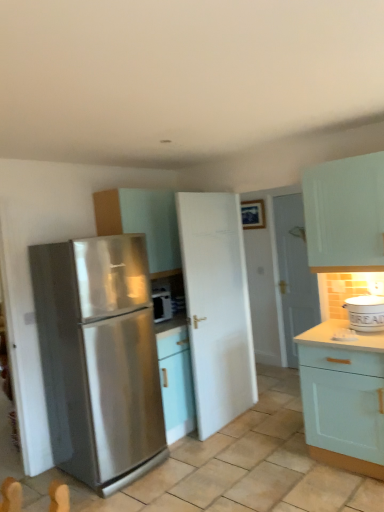
At what (x,y) coordinates should I click in order to perform the action: click on matte white cabinet at center, which is the first cabinetry from top to bottom. Please return your answer as a coordinate pair (x, y). Looking at the image, I should click on (142, 222).

Image resolution: width=384 pixels, height=512 pixels. I want to click on light teal wood cabinet at lower right, which is the second cabinetry in left-to-right order, so click(343, 398).

Consider the image. How much space does light teal wood cabinet at lower right, positioned as the 1th cabinetry in right-to-left order, occupy vertically?

The height of light teal wood cabinet at lower right, positioned as the 1th cabinetry in right-to-left order, is 35.00 inches.

Find the location of a particular element. This screenshot has height=512, width=384. white ceramic bucket at right, which is the 1th appliance from right to left is located at coordinates (365, 313).

Where is `stainless steel microwave at center, the first appliance from the back`? This screenshot has height=512, width=384. stainless steel microwave at center, the first appliance from the back is located at coordinates (161, 305).

Where is `stainless steel refrigerator at left`? The image size is (384, 512). stainless steel refrigerator at left is located at coordinates (99, 358).

Looking at this image, does stainless steel refrigerator at left appear on the left side of matte white cabinet at center, acting as the second cabinetry starting from the right?

Yes.

From the image's perspective, is stainless steel refrigerator at left over matte white cabinet at center, acting as the second cabinetry starting from the right?

No, from the image's perspective, stainless steel refrigerator at left is not over matte white cabinet at center, acting as the second cabinetry starting from the right.

Considering the positions of points (107, 433) and (121, 200), is point (107, 433) closer to camera compared to point (121, 200)?

Yes, point (107, 433) is closer to viewer.

From the picture: From a real-world perspective, which is physically above, stainless steel refrigerator at left or white matte door at center, which is counted as the 1th door, starting from the left?

From a 3D spatial view, white matte door at center, which is counted as the 1th door, starting from the left, is above.

Who is shorter, stainless steel refrigerator at left or white matte door at center, which is counted as the 1th door, starting from the left?

Standing shorter between the two is stainless steel refrigerator at left.

Is stainless steel refrigerator at left with white matte door at center, which ranks as the first door in front-to-back order?

No, stainless steel refrigerator at left is not with white matte door at center, which ranks as the first door in front-to-back order.

Is point (134, 406) closer or farther from the camera than point (235, 345)?

Point (134, 406) appears to be closer to the viewer than point (235, 345).

Considering the relative positions of white glossy door at center, positioned as the 2th door in left-to-right order, and white ceramic bucket at right, which is the 1th appliance from right to left, in the image provided, is white glossy door at center, positioned as the 2th door in left-to-right order, to the left of white ceramic bucket at right, which is the 1th appliance from right to left, from the viewer's perspective?

Indeed, white glossy door at center, positioned as the 2th door in left-to-right order, is positioned on the left side of white ceramic bucket at right, which is the 1th appliance from right to left.

Where is `appliance below the white glossy door at center, which is the second door from front to back (from a real-world perspective)`? The height and width of the screenshot is (512, 384). appliance below the white glossy door at center, which is the second door from front to back (from a real-world perspective) is located at coordinates (365, 313).

Can you confirm if white glossy door at center, which is the second door from front to back, is smaller than white ceramic bucket at right, the second appliance in the back-to-front sequence?

Incorrect, white glossy door at center, which is the second door from front to back, is not smaller in size than white ceramic bucket at right, the second appliance in the back-to-front sequence.

Considering the positions of point (225, 370) and point (380, 314), is point (225, 370) closer or farther from the camera than point (380, 314)?

Clearly, point (225, 370) is more distant from the camera than point (380, 314).

Is white matte door at center, which is counted as the 1th door, starting from the left, in front of or behind white ceramic bucket at right, the second appliance in the back-to-front sequence, in the image?

In the image, white matte door at center, which is counted as the 1th door, starting from the left, appears behind white ceramic bucket at right, the second appliance in the back-to-front sequence.

Which of these two, white matte door at center, arranged as the second door when viewed from the right, or white ceramic bucket at right, the second appliance in the back-to-front sequence, is wider?

white ceramic bucket at right, the second appliance in the back-to-front sequence.

From a real-world perspective, is white ceramic bucket at right, which is counted as the 2th appliance, starting from the left, over light teal wood cabinet at lower right, arranged as the 2th cabinetry when viewed from the back?

Yes, from a real-world perspective, white ceramic bucket at right, which is counted as the 2th appliance, starting from the left, is above light teal wood cabinet at lower right, arranged as the 2th cabinetry when viewed from the back.

Considering the relative positions of white ceramic bucket at right, the second appliance in the back-to-front sequence, and light teal wood cabinet at lower right, arranged as the 2th cabinetry when viewed from the back, in the image provided, is white ceramic bucket at right, the second appliance in the back-to-front sequence, in front of light teal wood cabinet at lower right, arranged as the 2th cabinetry when viewed from the back,?

No, white ceramic bucket at right, the second appliance in the back-to-front sequence, is behind light teal wood cabinet at lower right, arranged as the 2th cabinetry when viewed from the back.

Is white ceramic bucket at right, which is the first appliance from front to back, smaller than light teal wood cabinet at lower right, the second cabinetry from the top?

Yes.

How many degrees apart are the facing directions of white glossy door at center, the 1th door positioned from the back, and white matte door at center, acting as the 2th door starting from the back?

91 degrees separate the facing orientations of white glossy door at center, the 1th door positioned from the back, and white matte door at center, acting as the 2th door starting from the back.

Are white glossy door at center, positioned as the 2th door in left-to-right order, and white matte door at center, which is counted as the 1th door, starting from the left, far apart?

Indeed, white glossy door at center, positioned as the 2th door in left-to-right order, is not near white matte door at center, which is counted as the 1th door, starting from the left.

Could you tell me if white glossy door at center, positioned as the 2th door in left-to-right order, is turned towards white matte door at center, acting as the 2th door starting from the back?

Yes, white glossy door at center, positioned as the 2th door in left-to-right order, is aimed at white matte door at center, acting as the 2th door starting from the back.

Is the depth of white ceramic bucket at right, which is the 1th appliance from right to left, less than that of stainless steel microwave at center, the first appliance from the back?

Yes, it is.

Is stainless steel microwave at center, arranged as the 2th appliance when viewed from the front, inside white ceramic bucket at right, the second appliance in the back-to-front sequence?

Definitely not — stainless steel microwave at center, arranged as the 2th appliance when viewed from the front, is not inside white ceramic bucket at right, the second appliance in the back-to-front sequence.

Considering the relative positions of white ceramic bucket at right, which is the first appliance from front to back, and stainless steel microwave at center, arranged as the 2th appliance when viewed from the front, in the image provided, is white ceramic bucket at right, which is the first appliance from front to back, to the left of stainless steel microwave at center, arranged as the 2th appliance when viewed from the front, from the viewer's perspective?

No, white ceramic bucket at right, which is the first appliance from front to back, is not to the left of stainless steel microwave at center, arranged as the 2th appliance when viewed from the front.

Does white ceramic bucket at right, which is the first appliance from front to back, have a greater height compared to stainless steel microwave at center, the first appliance from the back?

No.

Image resolution: width=384 pixels, height=512 pixels. Identify the location of refrigerator below the matte white cabinet at center, arranged as the second cabinetry when ordered from the bottom (from the image's perspective). (99, 358).

From the image's perspective, which door is the 1st one above the stainless steel refrigerator at left? Please provide its 2D coordinates.

[(217, 307)]

Estimate the real-world distances between objects in this image. Which object is closer to light teal wood cabinet at lower right, the second cabinetry from the top, stainless steel refrigerator at left or white matte door at center, acting as the 2th door starting from the back?

white matte door at center, acting as the 2th door starting from the back, is positioned closer to the anchor light teal wood cabinet at lower right, the second cabinetry from the top.

Which object lies nearer to the anchor point white ceramic bucket at right, the second appliance in the back-to-front sequence, light teal wood cabinet at lower right, arranged as the 2th cabinetry when viewed from the back, or stainless steel refrigerator at left?

light teal wood cabinet at lower right, arranged as the 2th cabinetry when viewed from the back, is positioned closer to the anchor white ceramic bucket at right, the second appliance in the back-to-front sequence.

Based on their spatial positions, is white matte door at center, acting as the 2th door starting from the back, or stainless steel microwave at center, marked as the 2th appliance in a right-to-left arrangement, closer to light teal wood cabinet at lower right, marked as the first cabinetry in a front-to-back arrangement?

white matte door at center, acting as the 2th door starting from the back, lies closer to light teal wood cabinet at lower right, marked as the first cabinetry in a front-to-back arrangement, than the other object.

Considering their positions, is stainless steel microwave at center, the first appliance from the back, positioned closer to light teal wood cabinet at lower right, positioned as the 1th cabinetry in bottom-to-top order, than white ceramic bucket at right, which is counted as the 2th appliance, starting from the left?

white ceramic bucket at right, which is counted as the 2th appliance, starting from the left, lies closer to light teal wood cabinet at lower right, positioned as the 1th cabinetry in bottom-to-top order, than the other object.

From the picture: Based on their spatial positions, is light teal wood cabinet at lower right, which is the second cabinetry in left-to-right order, or white ceramic bucket at right, the second appliance in the back-to-front sequence, closer to white matte door at center, which is counted as the 1th door, starting from the left?

light teal wood cabinet at lower right, which is the second cabinetry in left-to-right order, lies closer to white matte door at center, which is counted as the 1th door, starting from the left, than the other object.

When comparing their distances from stainless steel microwave at center, the first appliance from the back, does stainless steel refrigerator at left or white glossy door at center, which is the second door from front to back, seem closer?

stainless steel refrigerator at left lies closer to stainless steel microwave at center, the first appliance from the back, than the other object.

Looking at the image, which one is located further to stainless steel microwave at center, arranged as the 2th appliance when viewed from the front, matte white cabinet at center, which is the first cabinetry from top to bottom, or white glossy door at center, positioned as the 2th door in left-to-right order?

white glossy door at center, positioned as the 2th door in left-to-right order, is further to stainless steel microwave at center, arranged as the 2th appliance when viewed from the front.

Looking at the image, which one is located further to white glossy door at center, positioned as the 2th door in left-to-right order, white matte door at center, which ranks as the first door in front-to-back order, or white ceramic bucket at right, the second appliance in the back-to-front sequence?

white ceramic bucket at right, the second appliance in the back-to-front sequence.

The height and width of the screenshot is (512, 384). In order to click on cabinetry located between light teal wood cabinet at lower right, which is the second cabinetry in left-to-right order, and white glossy door at center, positioned as the 2th door in left-to-right order, in the depth direction in this screenshot , I will do `click(142, 222)`.

In order to click on door situated between matte white cabinet at center, acting as the first cabinetry starting from the left, and white glossy door at center, positioned as the 2th door in left-to-right order, from left to right in this screenshot , I will do `click(217, 307)`.

Identify the location of refrigerator positioned between light teal wood cabinet at lower right, the second cabinetry from the top, and white glossy door at center, which appears as the first door when viewed from the right, from near to far. (99, 358).

I want to click on door between stainless steel microwave at center, placed as the 1th appliance when sorted from left to right, and white glossy door at center, positioned as the 2th door in left-to-right order, from left to right, so click(x=217, y=307).